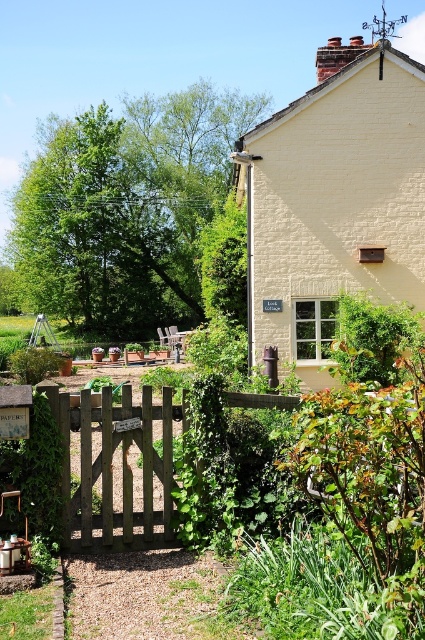
You are planning to paint the yellow brick cottage at upper center and the brown wooden gate at center. If you want to use the same amount of paint per unit area for both, which object requires more paint?

The yellow brick cottage at upper center requires more paint because its width is larger than the brown wooden gate at center, so it has a greater surface area to cover.

From the picture: You are standing in front of the cottage and want to place a new flowerpot between the two points, point (357, 214) and point (127, 445). Which point should the flowerpot be closer to so that it is positioned closer to the viewer?

The flowerpot should be closer to point (357, 214) because it is closer to the viewer than point (127, 445).

You are standing in front of the cottage and want to locate the point at coordinates (334, 202). Where exactly on the cottage would you find this point?

The point at coordinates (334, 202) is located on the yellow brick cottage at upper center.